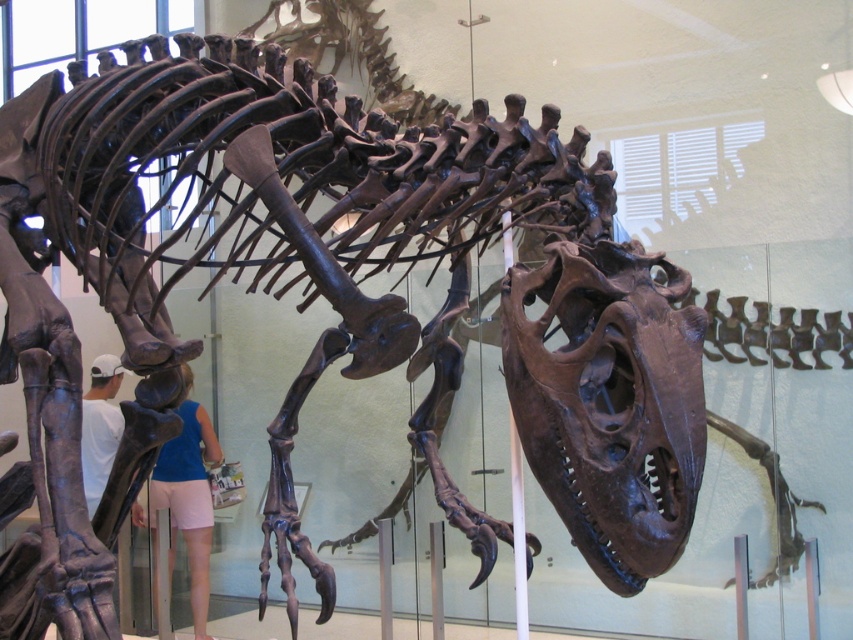
Question: Among these objects, which one is nearest to the camera?

Choices:
 (A) white matte shirt at lower left
 (B) blue fabric shorts at lower center

Answer: (B)

Question: Does blue fabric shorts at lower center have a larger size compared to white matte shirt at lower left?

Choices:
 (A) no
 (B) yes

Answer: (B)

Question: Among these objects, which one is farthest from the camera?

Choices:
 (A) white matte shirt at lower left
 (B) blue fabric shorts at lower center

Answer: (A)

Question: Is blue fabric shorts at lower center to the right of white matte shirt at lower left from the viewer's perspective?

Choices:
 (A) yes
 (B) no

Answer: (A)

Question: Is blue fabric shorts at lower center closer to the viewer compared to white matte shirt at lower left?

Choices:
 (A) yes
 (B) no

Answer: (A)

Question: Which object appears farthest from the camera in this image?

Choices:
 (A) blue fabric shorts at lower center
 (B) white matte shirt at lower left

Answer: (B)